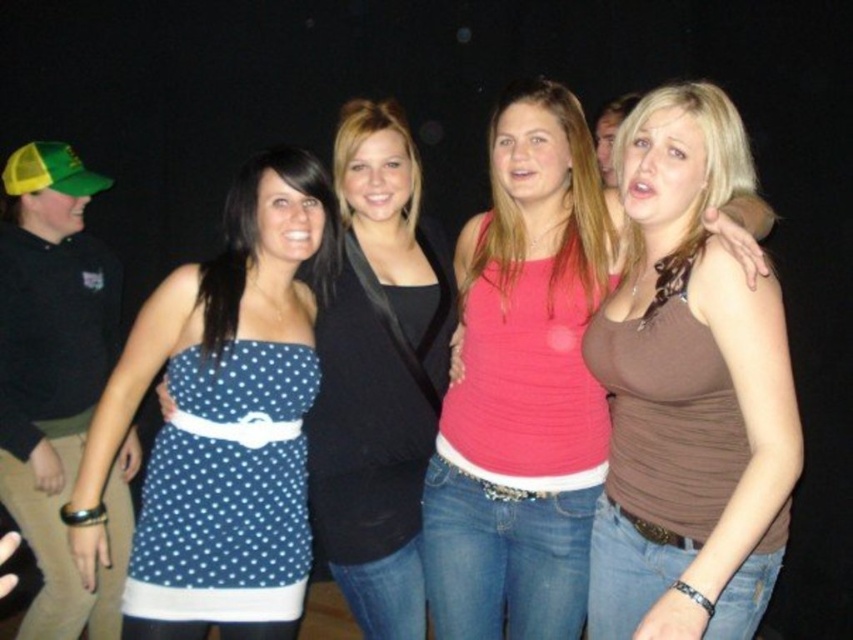
You are a photographer at a social event. You need to adjust the lighting so that the brown matte tank top at center and the blue polka dot dress at center are both visible. Since the background is dark, which object should you focus on to ensure proper exposure?

The brown matte tank top at center has a greater height compared to the blue polka dot dress at center, so focusing on the brown matte tank top at center would ensure proper exposure due to its larger size.

You are a photographer at the event and need to adjust the lighting to ensure both the blue polka dot dress at left and the blue polka dot dress at center are well lit. Since the background is dark, which dress might require more light to be shone on it? Please explain your reasoning based on their sizes.

The blue polka dot dress at left is larger in size compared to the blue polka dot dress at center. Since it covers more area, it might require more light to ensure proper illumination, especially in a dark background. Therefore, adjusting the lighting to focus slightly more on the larger dress could help both stand out.